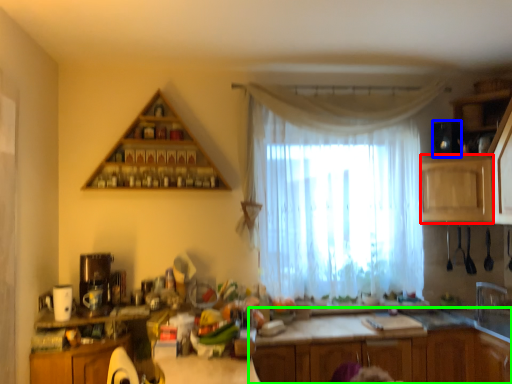
Question: Which object is the farthest from cabinetry (highlighted by a red box)? Choose among these: appliance (highlighted by a blue box) or cabinetry (highlighted by a green box).

Choices:
 (A) appliance
 (B) cabinetry

Answer: (B)